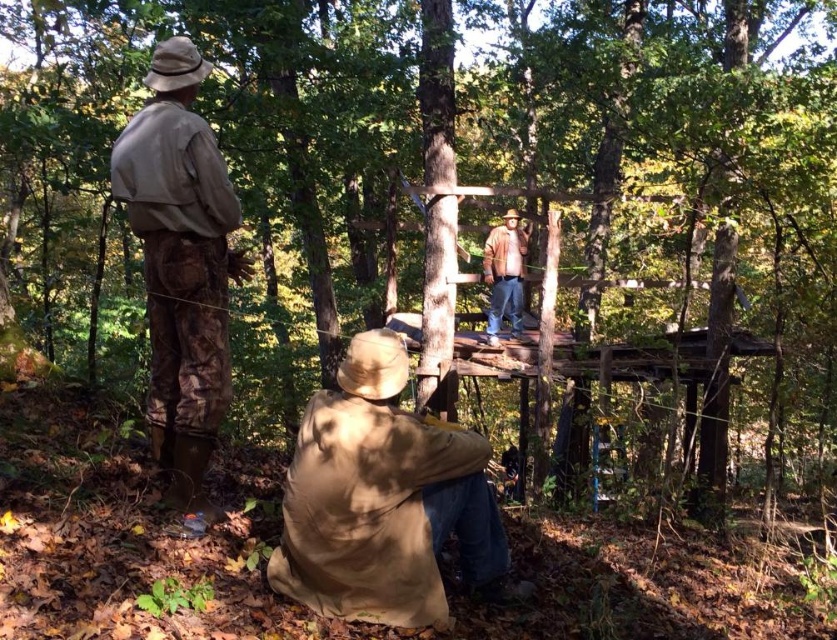
You are a hiker who needs to pass between the tan fabric jacket at lower center and the brown leather jacket at upper center. The path between them is narrow. If your backpack is 2 meters wide, will you fit through the space between them?

The distance between the tan fabric jacket at lower center and the brown leather jacket at upper center is 7.88 meters. Since your backpack is only 2 meters wide, you will have enough space to pass through the path between them.

You are a hiker trying to locate two jackets in the scene. The tan fabric jacket at lower center and the brown leather jacket at upper center. Which jacket is positioned lower in the image?

The tan fabric jacket at lower center is positioned lower in the image than the brown leather jacket at upper center.

You are a hiker trying to identify clothing items in the scene. Which clothing item, the camouflage pants at left or the brown leather jacket at upper center, is taller in the image?

The camouflage pants at left is taller than the brown leather jacket at upper center.